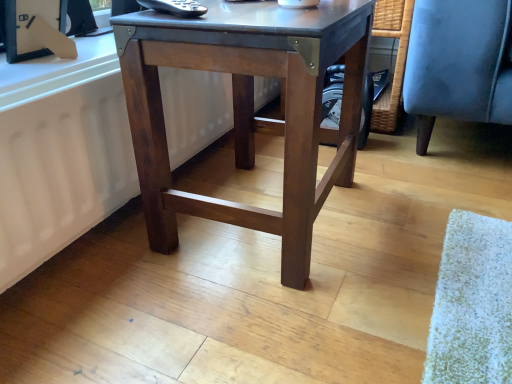
What is the approximate height of white matte radiator at lower left?

The height of white matte radiator at lower left is 12.32 inches.

Describe the element at coordinates (62, 170) in the screenshot. Image resolution: width=512 pixels, height=384 pixels. I see `white matte radiator at lower left` at that location.

Identify the location of white matte radiator at lower left. The height and width of the screenshot is (384, 512). pos(62,170).

Describe the element at coordinates (248, 109) in the screenshot. The height and width of the screenshot is (384, 512). I see `dark brown wood table at center` at that location.

Image resolution: width=512 pixels, height=384 pixels. In order to click on dark brown wood table at center in this screenshot , I will do `click(248, 109)`.

Find the location of a particular element. This screenshot has height=384, width=512. white matte radiator at lower left is located at coordinates (62, 170).

Is dark brown wood table at center to the left or to the right of white matte radiator at lower left in the image?

Clearly, dark brown wood table at center is on the right of white matte radiator at lower left in the image.

Does dark brown wood table at center lie in front of white matte radiator at lower left?

That is True.

Is point (282, 52) less distant than point (38, 179)?

That is True.

From the image's perspective, is dark brown wood table at center above white matte radiator at lower left?

Correct, dark brown wood table at center appears higher than white matte radiator at lower left in the image.

From a real-world perspective, does dark brown wood table at center sit lower than white matte radiator at lower left?

Incorrect, from a real-world perspective, dark brown wood table at center is higher than white matte radiator at lower left.

Between dark brown wood table at center and white matte radiator at lower left, which one has smaller width?

With smaller width is white matte radiator at lower left.

Can you confirm if dark brown wood table at center is taller than white matte radiator at lower left?

Yes, dark brown wood table at center is taller than white matte radiator at lower left.

Does dark brown wood table at center have a larger size compared to white matte radiator at lower left?

Correct, dark brown wood table at center is larger in size than white matte radiator at lower left.

Is dark brown wood table at center spatially inside white matte radiator at lower left, or outside of it?

The correct answer is: outside.

Is dark brown wood table at center beside white matte radiator at lower left?

dark brown wood table at center and white matte radiator at lower left are clearly separated.

Is dark brown wood table at center oriented towards white matte radiator at lower left?

No, dark brown wood table at center is not facing towards white matte radiator at lower left.

How many degrees apart are the facing directions of dark brown wood table at center and white matte radiator at lower left?

The angle between the facing direction of dark brown wood table at center and the facing direction of white matte radiator at lower left is 1.61 degrees.

Find the location of a particular element. The height and width of the screenshot is (384, 512). table above the white matte radiator at lower left (from a real-world perspective) is located at coordinates (248, 109).

Consider the image. Which is more to the left, white matte radiator at lower left or dark brown wood table at center?

Positioned to the left is white matte radiator at lower left.

Is the depth of white matte radiator at lower left greater than that of dark brown wood table at center?

That is True.

Considering the positions of point (11, 212) and point (340, 169), is point (11, 212) closer or farther from the camera than point (340, 169)?

Point (11, 212) is positioned closer to the camera compared to point (340, 169).

From the image's perspective, is white matte radiator at lower left above or below dark brown wood table at center?

From the image's perspective, white matte radiator at lower left appears below dark brown wood table at center.

From a real-world perspective, which is physically below, white matte radiator at lower left or dark brown wood table at center?

white matte radiator at lower left.

Which of these two, white matte radiator at lower left or dark brown wood table at center, is thinner?

white matte radiator at lower left is thinner.

Does white matte radiator at lower left have a greater height compared to dark brown wood table at center?

Incorrect, the height of white matte radiator at lower left is not larger of that of dark brown wood table at center.

Can you confirm if white matte radiator at lower left is bigger than dark brown wood table at center?

No.

Would you say white matte radiator at lower left is inside or outside dark brown wood table at center?

The correct answer is: outside.

Would you say white matte radiator at lower left is a long distance from dark brown wood table at center?

That's not correct — white matte radiator at lower left is a little close to dark brown wood table at center.

Does white matte radiator at lower left turn towards dark brown wood table at center?

Yes, white matte radiator at lower left is turned towards dark brown wood table at center.

What's the angular difference between white matte radiator at lower left and dark brown wood table at center's facing directions?

white matte radiator at lower left and dark brown wood table at center are facing 1.61 degrees away from each other.

Locate an element on the screen. radiator lying below the dark brown wood table at center (from the image's perspective) is located at coordinates 62,170.

Locate an element on the screen. The height and width of the screenshot is (384, 512). table above the white matte radiator at lower left (from a real-world perspective) is located at coordinates (248, 109).

Where is `radiator located on the left of dark brown wood table at center`? Image resolution: width=512 pixels, height=384 pixels. radiator located on the left of dark brown wood table at center is located at coordinates (62, 170).